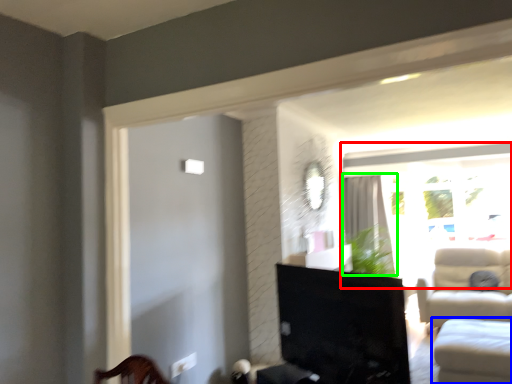
Question: Estimate the real-world distances between objects in this image. Which object is closer to window (highlighted by a red box), studio couch (highlighted by a blue box) or curtain (highlighted by a green box)?

Choices:
 (A) studio couch
 (B) curtain

Answer: (B)